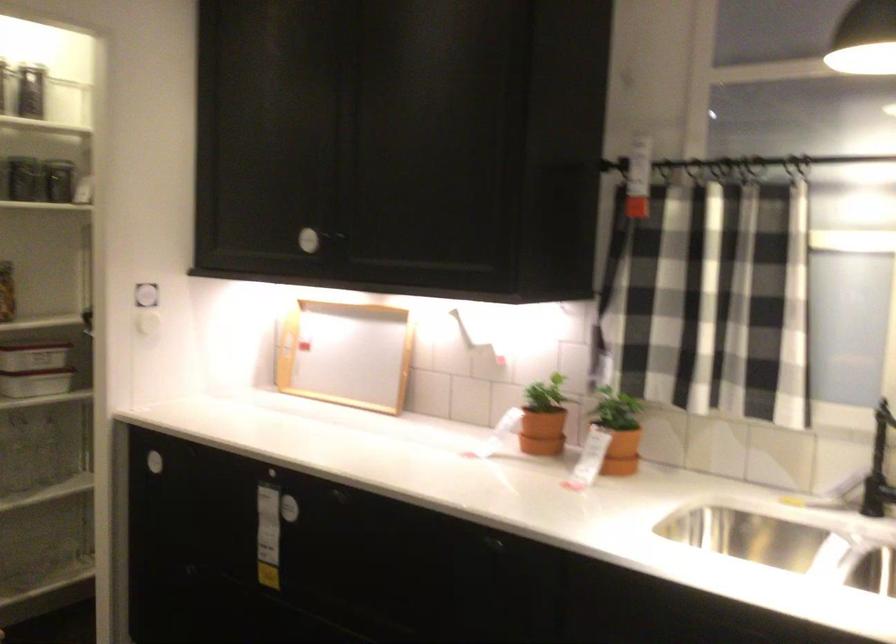
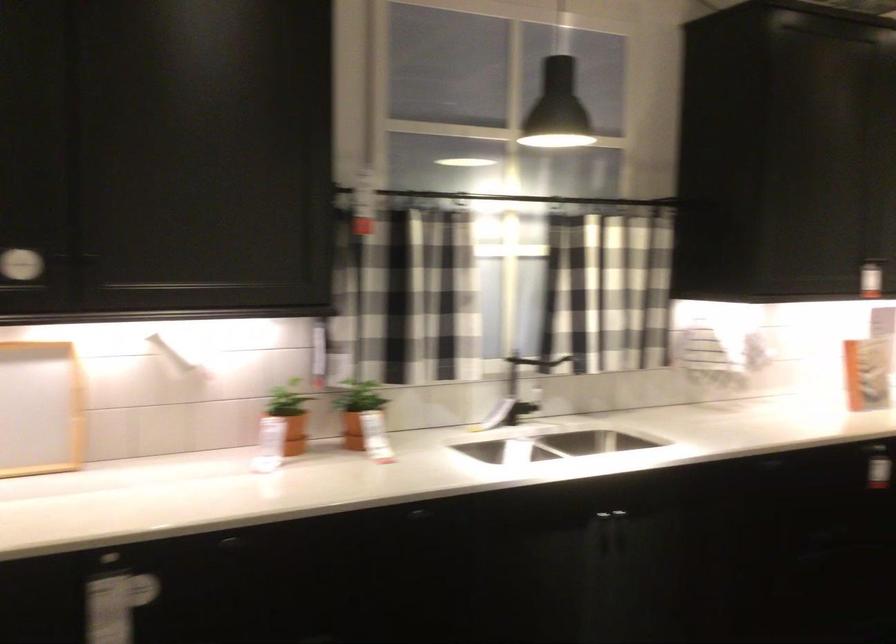
The point at (711, 292) is marked in the first image. Where is the corresponding point in the second image?

(403, 295)